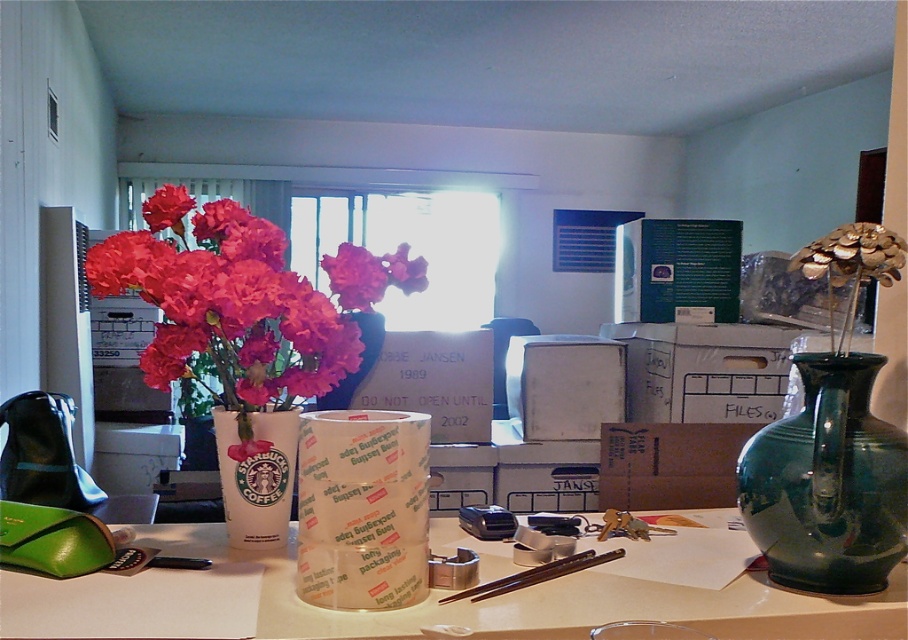
From the picture: Can you confirm if white paper at center is taller than white cardboard box at center?

No.

Is white paper at center smaller than white cardboard box at center?

Yes, white paper at center is smaller than white cardboard box at center.

Does point (664, 609) come behind point (722, 333)?

That is False.

In order to click on white paper at center in this screenshot , I will do `click(416, 604)`.

Looking at this image, can you confirm if green glossy vase at right is positioned to the right of matte pink petals at center?

Indeed, green glossy vase at right is positioned on the right side of matte pink petals at center.

Which is behind, point (775, 429) or point (216, 237)?

The point (216, 237) is behind.

What do you see at coordinates (827, 483) in the screenshot? The width and height of the screenshot is (908, 640). I see `green glossy vase at right` at bounding box center [827, 483].

This screenshot has width=908, height=640. What are the coordinates of `green glossy vase at right` in the screenshot? It's located at (827, 483).

Between white paper at center and matte pink flower at center, which one appears on the right side from the viewer's perspective?

white paper at center is more to the right.

The image size is (908, 640). What are the coordinates of `white paper at center` in the screenshot? It's located at (416, 604).